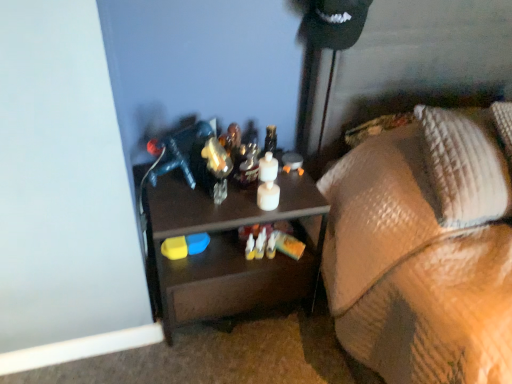
Question: Is woven fabric pillow at right to the left of textured brown blanket at lower right from the viewer's perspective?

Choices:
 (A) yes
 (B) no

Answer: (B)

Question: Is textured brown blanket at lower right surrounded by woven fabric pillow at right?

Choices:
 (A) no
 (B) yes

Answer: (A)

Question: From the image's perspective, does woven fabric pillow at right appear lower than textured brown blanket at lower right?

Choices:
 (A) no
 (B) yes

Answer: (A)

Question: Is woven fabric pillow at right behind textured brown blanket at lower right?

Choices:
 (A) yes
 (B) no

Answer: (A)

Question: Can you confirm if woven fabric pillow at right is taller than textured brown blanket at lower right?

Choices:
 (A) no
 (B) yes

Answer: (A)

Question: Is woven fabric pillow at right bigger than textured brown blanket at lower right?

Choices:
 (A) yes
 (B) no

Answer: (B)

Question: From the image's perspective, does textured brown blanket at lower right appear lower than woven fabric pillow at right?

Choices:
 (A) yes
 (B) no

Answer: (A)

Question: Can you confirm if textured brown blanket at lower right is smaller than woven fabric pillow at right?

Choices:
 (A) no
 (B) yes

Answer: (A)

Question: From a real-world perspective, does textured brown blanket at lower right sit lower than woven fabric pillow at right?

Choices:
 (A) yes
 (B) no

Answer: (A)

Question: From a real-world perspective, is textured brown blanket at lower right located higher than woven fabric pillow at right?

Choices:
 (A) no
 (B) yes

Answer: (A)

Question: Is textured brown blanket at lower right facing towards woven fabric pillow at right?

Choices:
 (A) no
 (B) yes

Answer: (A)

Question: Does textured brown blanket at lower right have a greater width compared to woven fabric pillow at right?

Choices:
 (A) yes
 (B) no

Answer: (A)

Question: From a real-world perspective, is textured brown blanket at lower right under brown matte desk at center?

Choices:
 (A) no
 (B) yes

Answer: (A)